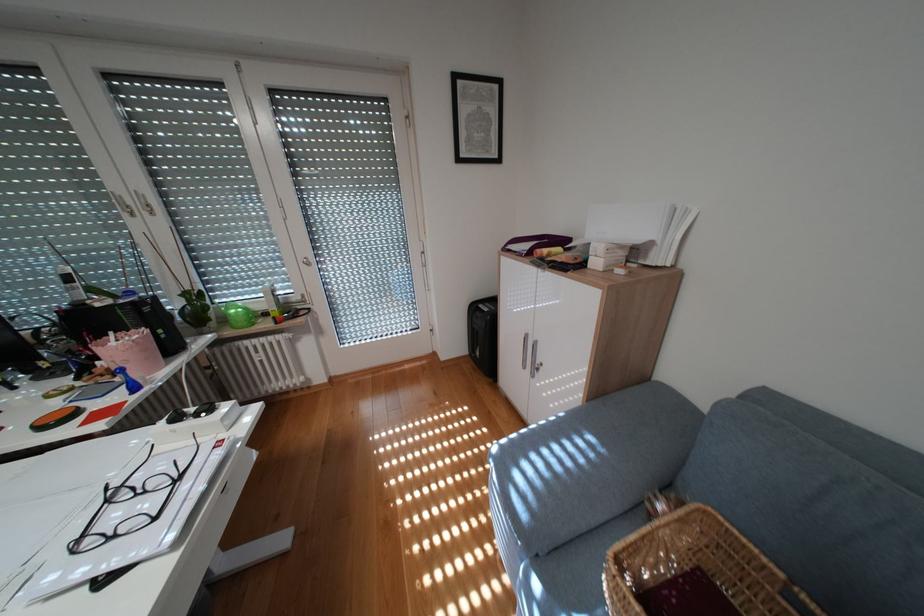
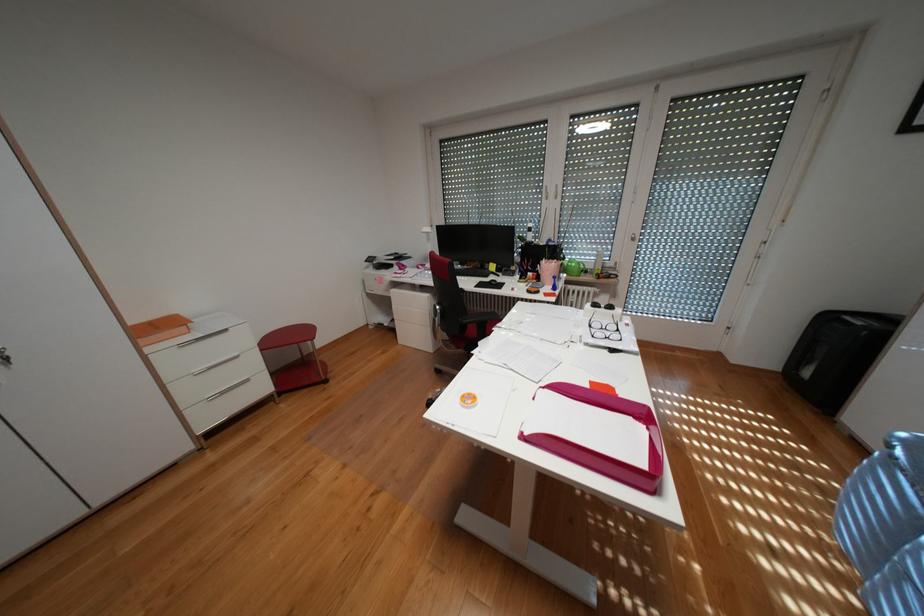
In the second image, find the point that corresponds to (119,501) in the first image.

(602, 325)